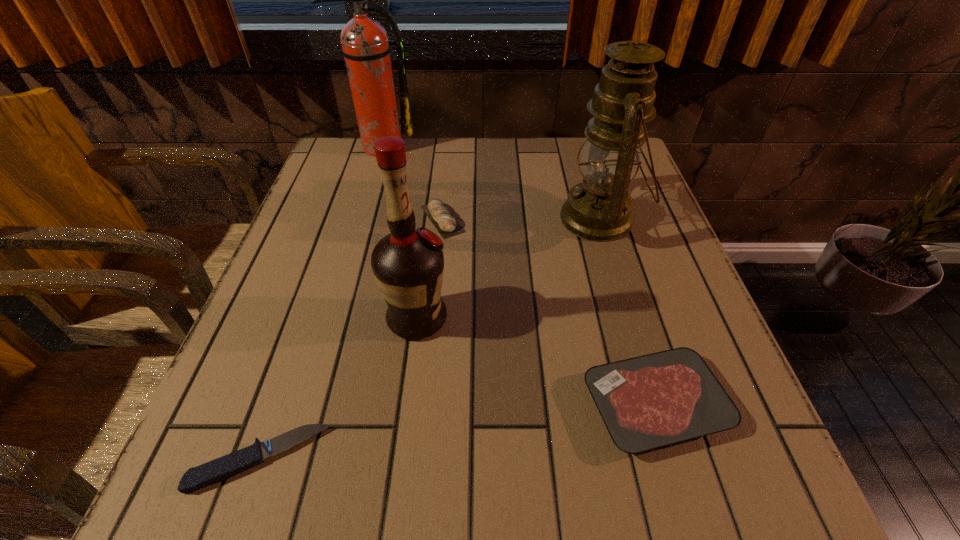
This screenshot has height=540, width=960. I want to click on blank space located on the back of the fifth tallest object, so click(x=610, y=251).

At what (x,y) coordinates should I click in order to perform the action: click on blank area located 0.200m on the back of the steak knife. Please return your answer as a coordinate pair (x, y). This screenshot has width=960, height=540. Looking at the image, I should click on (307, 323).

In order to click on object that is at the far edge in this screenshot , I will do `click(365, 46)`.

Locate an element on the screen. The width and height of the screenshot is (960, 540). steak present at the near edge is located at coordinates (655, 400).

Find the location of a particular element. steak knife present at the near edge is located at coordinates click(x=195, y=478).

Where is `fire extinguisher at the left edge`? fire extinguisher at the left edge is located at coordinates (365, 46).

Where is `steak knife that is at the left edge`? The width and height of the screenshot is (960, 540). steak knife that is at the left edge is located at coordinates (195, 478).

This screenshot has width=960, height=540. Find the location of `oil lamp present at the right edge`. oil lamp present at the right edge is located at coordinates [x=599, y=209].

Locate an element on the screen. steak located in the right edge section of the desktop is located at coordinates (655, 400).

In order to click on object at the far left corner in this screenshot , I will do `click(365, 46)`.